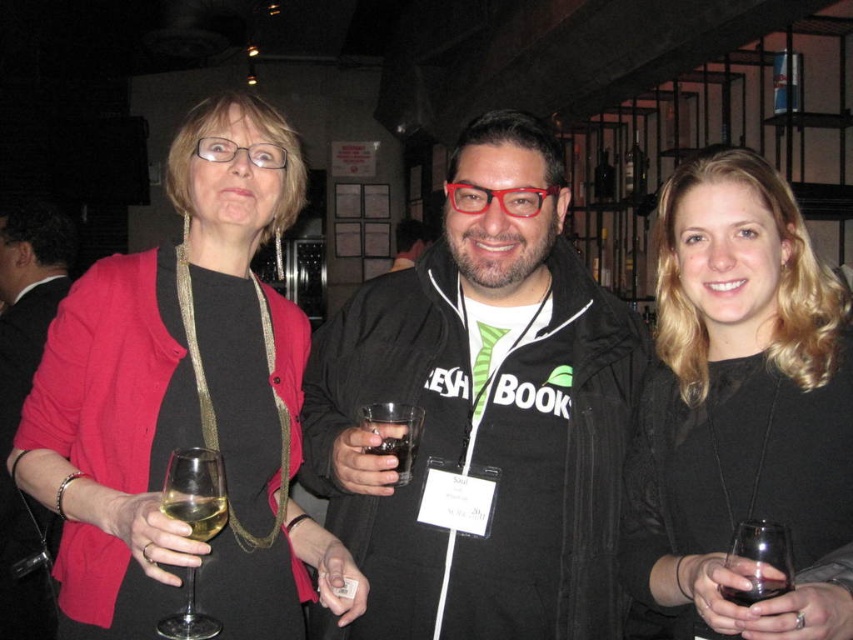
Question: Is matte black jacket at center to the left of dark glass at center from the viewer's perspective?

Choices:
 (A) no
 (B) yes

Answer: (A)

Question: Is matte black jacket at center to the left of matte black jacket at left from the viewer's perspective?

Choices:
 (A) no
 (B) yes

Answer: (A)

Question: Which object appears farthest from the camera in this image?

Choices:
 (A) translucent glass at lower left
 (B) black fabric jacket at center

Answer: (B)

Question: Can you confirm if matte black jacket at center is positioned to the right of dark glass at center?

Choices:
 (A) yes
 (B) no

Answer: (A)

Question: Which object is positioned farthest from the translucent glass wine at center left?

Choices:
 (A) matte black jacket at left
 (B) matte black jacket at center

Answer: (B)

Question: Which of the following is the farthest from the observer?

Choices:
 (A) dark glass at center
 (B) translucent glass at lower left
 (C) black matte dress at center
 (D) translucent glass wine at center left

Answer: (A)